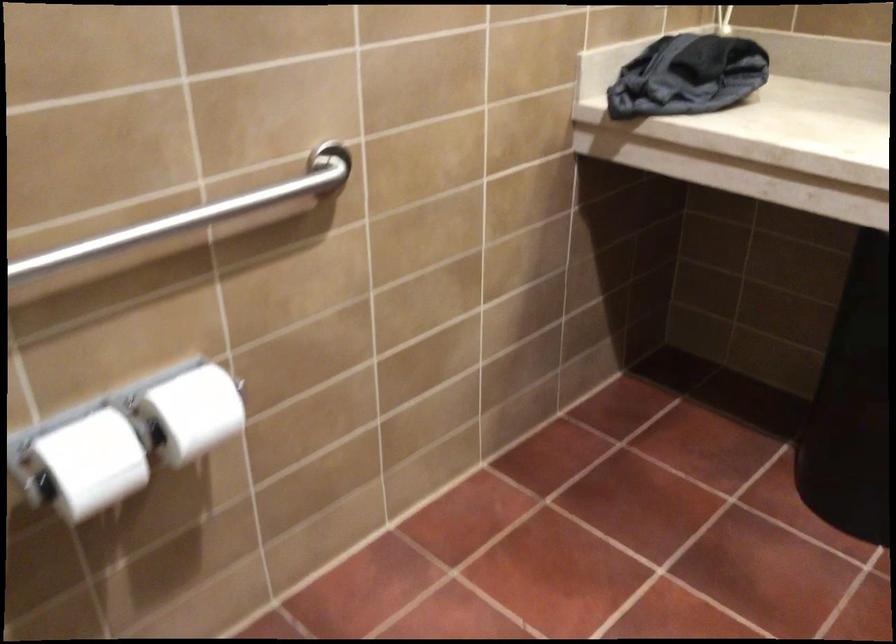
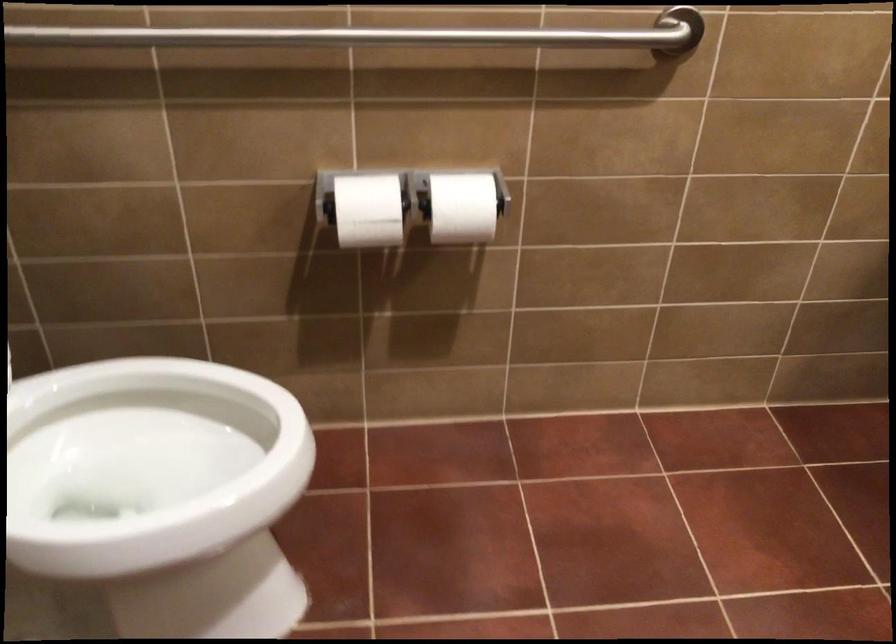
Where in the second image is the point corresponding to point (104, 462) from the first image?

(367, 210)